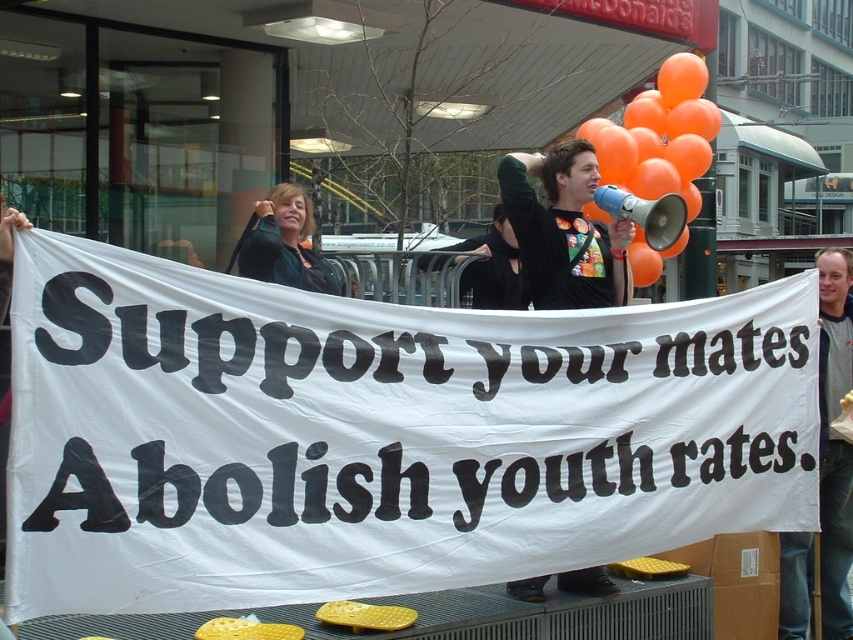
Which is above, white paper banner at center or matte black jacket at upper center?

matte black jacket at upper center is above.

Does white paper banner at center appear under matte black jacket at upper center?

Yes, white paper banner at center is below matte black jacket at upper center.

I want to click on white paper banner at center, so click(x=376, y=435).

Can you confirm if white paper banner at center is smaller than orange matte balloons at upper right?

Yes.

Looking at this image, measure the distance between white paper banner at center and camera.

white paper banner at center and camera are 11.03 feet apart.

Locate an element on the screen. white paper banner at center is located at coordinates (376, 435).

Between orange matte balloons at upper right and matte black jacket at upper center, which one has more height?

orange matte balloons at upper right

Between point (674, 179) and point (251, 260), which one is positioned in front?

Positioned in front is point (251, 260).

The height and width of the screenshot is (640, 853). I want to click on orange matte balloons at upper right, so click(x=660, y=134).